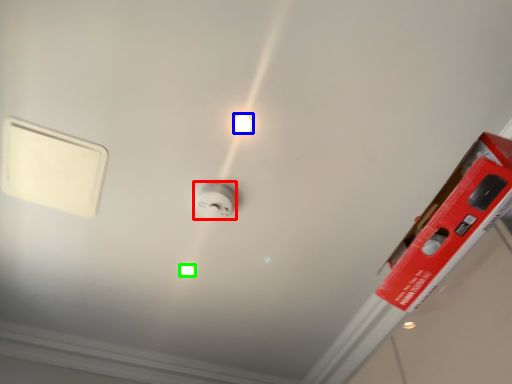
Question: Based on their relative distances, which object is farther from power plugs and sockets (highlighted by a red box)? Choose from light bulb (highlighted by a blue box) and light bulb (highlighted by a green box).

Choices:
 (A) light bulb
 (B) light bulb

Answer: (B)